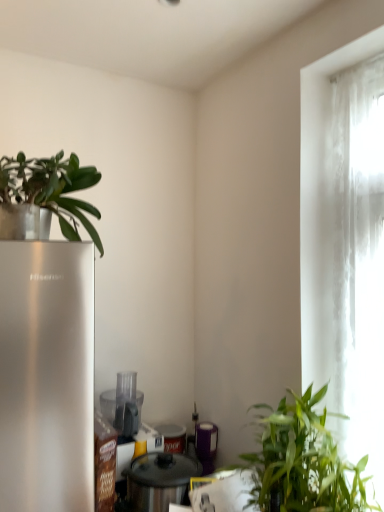
Question: Is the depth of metallic silver pot at center, the third appliance in the back-to-front sequence, greater than that of green matte plant at upper left, which is the 1th houseplant in top-to-bottom order?

Choices:
 (A) no
 (B) yes

Answer: (B)

Question: Does metallic silver pot at center, the third appliance in the back-to-front sequence, appear on the left side of green matte plant at upper left, which is the 1th houseplant in top-to-bottom order?

Choices:
 (A) yes
 (B) no

Answer: (B)

Question: Could you tell me if metallic silver pot at center, the first appliance positioned from the front, is facing green matte plant at upper left, the first houseplant positioned from the left?

Choices:
 (A) no
 (B) yes

Answer: (A)

Question: Is metallic silver pot at center, the first appliance positioned from the front, wider than green matte plant at upper left, the 2th houseplant in the right-to-left sequence?

Choices:
 (A) no
 (B) yes

Answer: (A)

Question: Considering the relative sizes of metallic silver pot at center, the first appliance positioned from the front, and green matte plant at upper left, which is the 1th houseplant in top-to-bottom order, in the image provided, is metallic silver pot at center, the first appliance positioned from the front, taller than green matte plant at upper left, which is the 1th houseplant in top-to-bottom order,?

Choices:
 (A) no
 (B) yes

Answer: (B)

Question: Visually, is purple matte canister at center, which appears as the third appliance when viewed from the front, positioned to the left or to the right of green leafy plant at lower right, which is the first houseplant from bottom to top?

Choices:
 (A) right
 (B) left

Answer: (B)

Question: From a real-world perspective, relative to green leafy plant at lower right, acting as the second houseplant starting from the left, is purple matte canister at center, positioned as the first appliance in back-to-front order, vertically above or below?

Choices:
 (A) above
 (B) below

Answer: (B)

Question: Based on their sizes in the image, would you say purple matte canister at center, positioned as the first appliance in back-to-front order, is bigger or smaller than green leafy plant at lower right, arranged as the first houseplant when viewed from the right?

Choices:
 (A) big
 (B) small

Answer: (B)

Question: Considering the positions of purple matte canister at center, which appears as the third appliance when viewed from the front, and green leafy plant at lower right, positioned as the second houseplant in top-to-bottom order, in the image, is purple matte canister at center, which appears as the third appliance when viewed from the front, wider or thinner than green leafy plant at lower right, positioned as the second houseplant in top-to-bottom order,?

Choices:
 (A) thin
 (B) wide

Answer: (A)

Question: Considering their positions, is green matte plant at upper left, which is the 1th houseplant in top-to-bottom order, located in front of or behind metallic silver pot at center, the first appliance positioned from the front?

Choices:
 (A) front
 (B) behind

Answer: (A)

Question: Is point (4, 170) positioned closer to the camera than point (178, 494)?

Choices:
 (A) farther
 (B) closer

Answer: (B)

Question: Which is correct: green matte plant at upper left, the first houseplant positioned from the left, is inside metallic silver pot at center, the third appliance in the back-to-front sequence, or outside of it?

Choices:
 (A) outside
 (B) inside

Answer: (A)

Question: From the image's perspective, is green matte plant at upper left, the 2th houseplant when ordered from bottom to top, above or below metallic silver pot at center, the third appliance in the back-to-front sequence?

Choices:
 (A) below
 (B) above

Answer: (B)

Question: Looking at the image, does translucent fabric curtain at right seem bigger or smaller compared to metallic silver pot at center, the third appliance in the back-to-front sequence?

Choices:
 (A) small
 (B) big

Answer: (B)

Question: Looking at their shapes, would you say translucent fabric curtain at right is wider or thinner than metallic silver pot at center, the third appliance in the back-to-front sequence?

Choices:
 (A) wide
 (B) thin

Answer: (B)